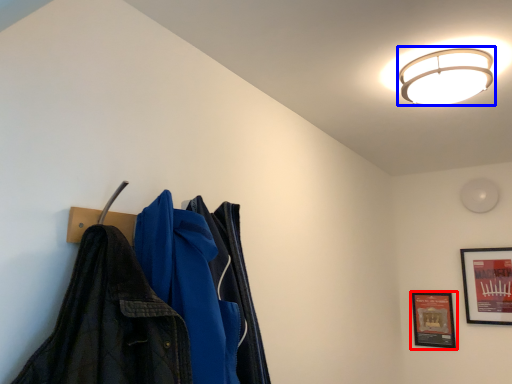
Question: Which object is further to the camera taking this photo, picture frame (highlighted by a red box) or lamp (highlighted by a blue box)?

Choices:
 (A) picture frame
 (B) lamp

Answer: (A)